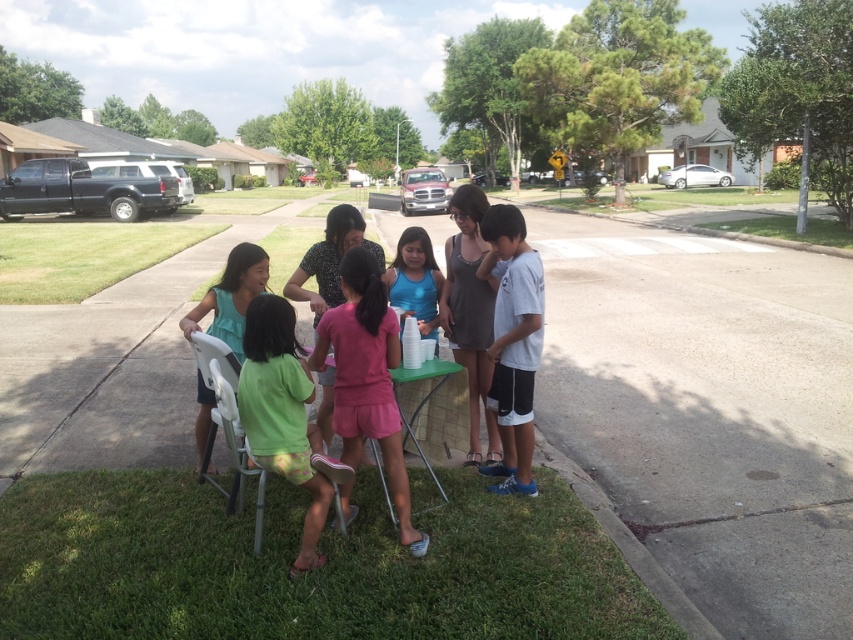
Who is more forward, (460,257) or (390,291)?

Point (460,257) is more forward.

Which is behind, point (457, 280) or point (434, 292)?

The point (434, 292) is more distant.

Is point (456, 305) less distant than point (422, 266)?

Yes, point (456, 305) is closer to viewer.

The height and width of the screenshot is (640, 853). What are the coordinates of `gray cotton dress at center` in the screenshot? It's located at (469, 312).

Does white cotton shirt at right appear over matte teal shirt at center?

No.

Does white cotton shirt at right lie behind matte teal shirt at center?

Yes, it is.

The height and width of the screenshot is (640, 853). What do you see at coordinates (514, 342) in the screenshot?
I see `white cotton shirt at right` at bounding box center [514, 342].

The height and width of the screenshot is (640, 853). What are the coordinates of `white cotton shirt at right` in the screenshot? It's located at click(514, 342).

Can you confirm if gray concrete pavement at center is shorter than white cotton shirt at right?

No, gray concrete pavement at center is not shorter than white cotton shirt at right.

Find the location of a particular element. The image size is (853, 640). gray concrete pavement at center is located at coordinates (709, 412).